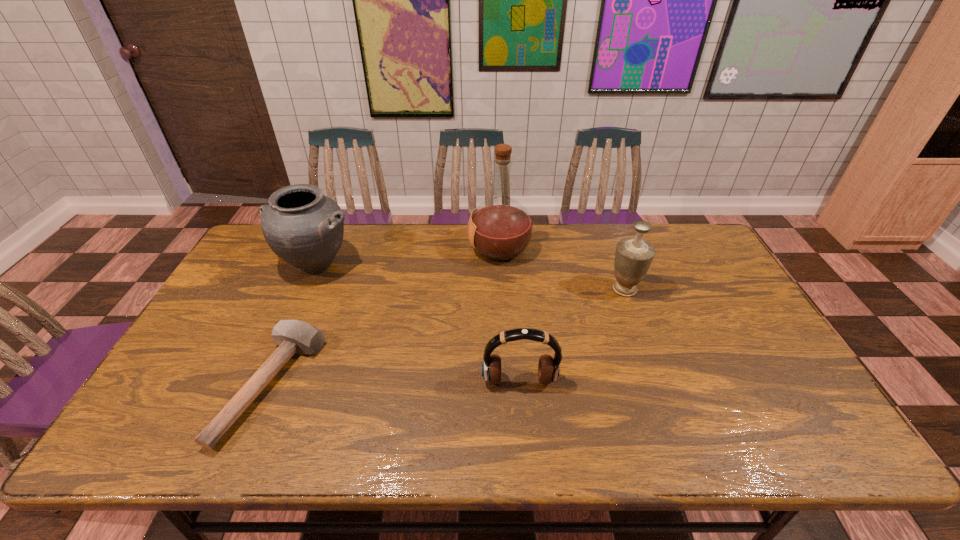
Locate which object ranks in proximity to the mallet. Please provide its 2D coordinates. Your answer should be formatted as a tuple, i.e. [(x, y)], where the tuple contains the x and y coordinates of a point satisfying the conditions above.

[(305, 228)]

Find the location of a particular element. The width and height of the screenshot is (960, 540). object that is the fourth closest to the mallet is located at coordinates (633, 256).

Identify the location of free space that satisfies the following two spatial constraints: 1. on the back side of the right urn; 2. on the front label of the liquor. The height and width of the screenshot is (540, 960). (610, 249).

Where is `free space in the image that satisfies the following two spatial constraints: 1. on the front side of the mallet; 2. on the right side of the left urn`? The width and height of the screenshot is (960, 540). free space in the image that satisfies the following two spatial constraints: 1. on the front side of the mallet; 2. on the right side of the left urn is located at coordinates (264, 385).

The image size is (960, 540). Identify the location of vacant space that satisfies the following two spatial constraints: 1. on the back side of the right urn; 2. on the front label of the liquor. (610, 249).